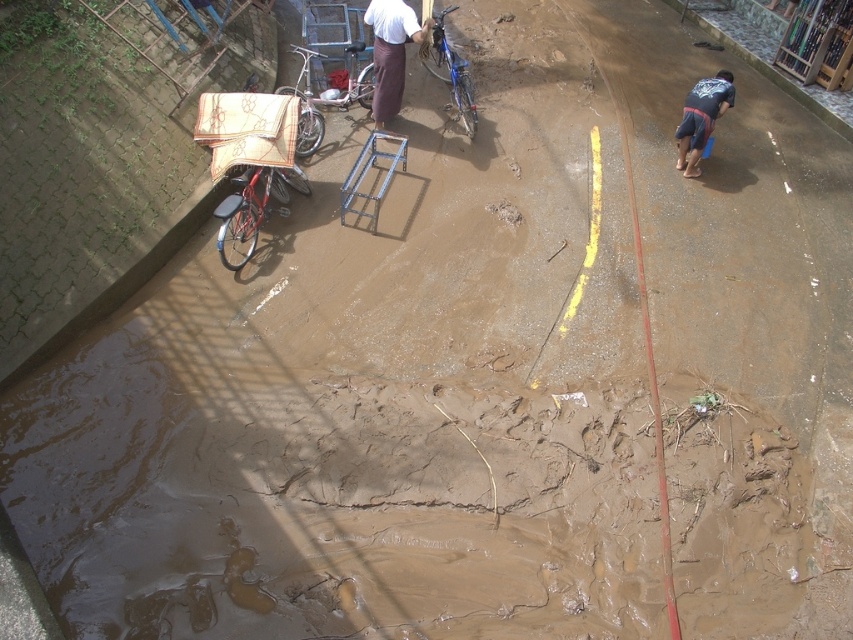
Question: Among these objects, which one is farthest from the camera?

Choices:
 (A) shiny red bicycle at left
 (B) brushed metal bicycle at upper left

Answer: (B)

Question: Is brushed metal bicycle at upper left to the left of dark blue fabric at lower right from the viewer's perspective?

Choices:
 (A) no
 (B) yes

Answer: (B)

Question: Which point is closer to the camera?

Choices:
 (A) (419, 33)
 (B) (697, 160)
 (C) (285, 173)
 (D) (357, 99)

Answer: (C)

Question: Which of these objects is positioned closest to the brushed metal bicycle at upper left?

Choices:
 (A) blue metallic bicycle at center
 (B) white fabric at center
 (C) dark blue fabric at lower right

Answer: (B)

Question: Is brushed metal bicycle at upper left to the right of blue metallic bicycle at center from the viewer's perspective?

Choices:
 (A) no
 (B) yes

Answer: (A)

Question: Can you confirm if white fabric at center is wider than blue metallic bicycle at center?

Choices:
 (A) no
 (B) yes

Answer: (B)